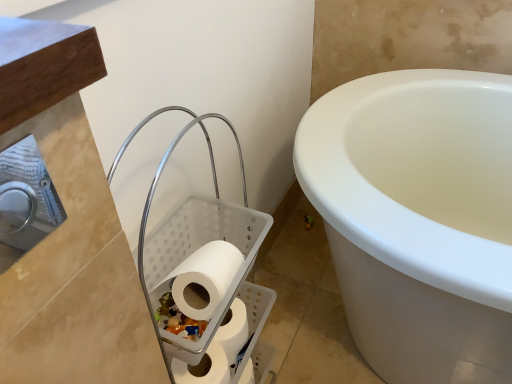
Question: Looking at their shapes, would you say white plastic laundry basket at upper left is wider or thinner than white matte toilet paper at lower center, which appears as the third toilet paper when viewed from the top?

Choices:
 (A) wide
 (B) thin

Answer: (A)

Question: In terms of height, does white plastic laundry basket at upper left look taller or shorter compared to white matte toilet paper at lower center, which appears as the third toilet paper when viewed from the top?

Choices:
 (A) tall
 (B) short

Answer: (A)

Question: Which object is the farthest from the white matte toilet paper at center, placed as the third toilet paper when sorted from bottom to top?

Choices:
 (A) white matte toilet paper at lower center, arranged as the 2th toilet paper when viewed from the top
 (B) white plastic laundry basket at upper left
 (C) white matte toilet paper at lower center, arranged as the first toilet paper when ordered from the bottom

Answer: (A)

Question: Estimate the real-world distances between objects in this image. Which object is closer to the white plastic laundry basket at upper left?

Choices:
 (A) white matte toilet paper at lower center, the 2th toilet paper when ordered from bottom to top
 (B) white matte toilet paper at center, which is the first toilet paper in top-to-bottom order
 (C) white matte toilet paper at lower center, arranged as the first toilet paper when ordered from the bottom

Answer: (B)